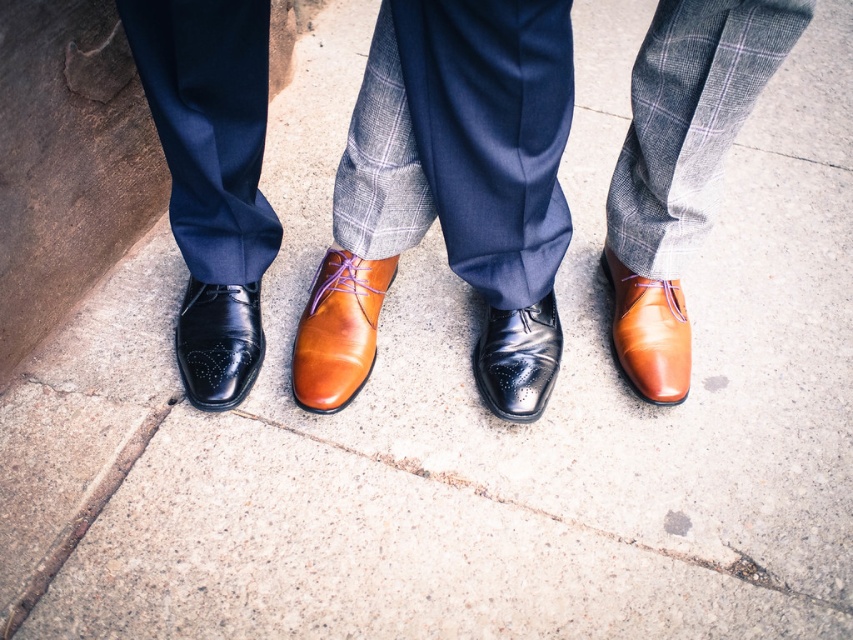
You are a photographer setting up a shoot in an urban area. You need to position a light source to the right of the cognac leather shoe at center so that it illuminates the shiny brown leather shoe at center. Is the current arrangement of the shoes suitable for this setup?

The shiny brown leather shoe at center is to the left of the cognac leather shoe at center. Since the light source needs to be placed to the right of the cognac leather shoe at center, the light would come from the right side of the cognac shoe, which is opposite to where the shiny brown shoe is located. This setup would not effectively illuminate the shiny brown leather shoe at center as the light would be behind it relative to the shoe.

You are a photographer setting up a shoot focusing on footwear details. You notice the black leather shoe at lower left and the glossy leather shoe at center. Which shoe is positioned higher in the image?

The black leather shoe at lower left is positioned higher in the image as it is above the glossy leather shoe at center.

Where is the shiny brown leather shoe at center located in the image?

The shiny brown leather shoe at center is located at point (x=338, y=330) in the image.